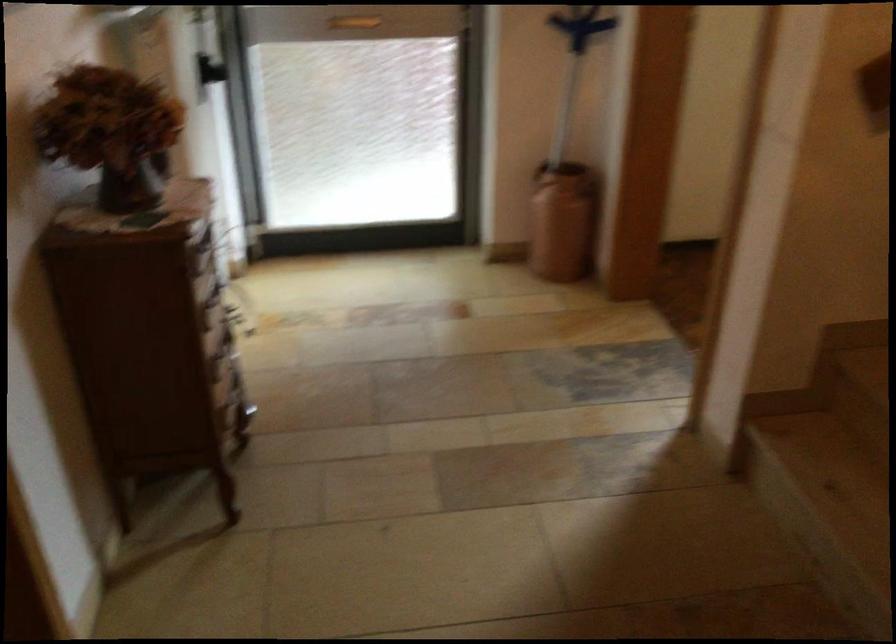
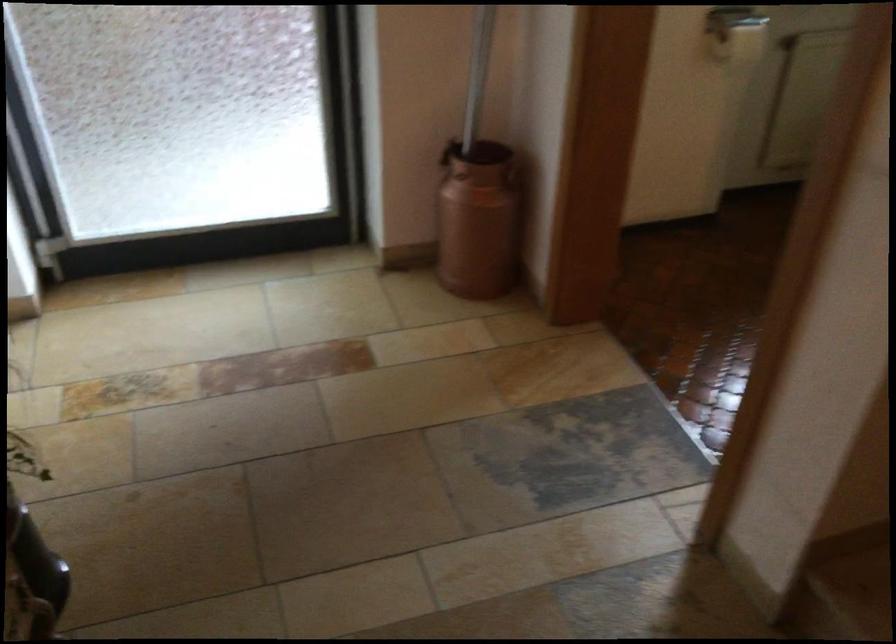
In the second image, find the point that corresponds to point 583,185 in the first image.

(513, 176)